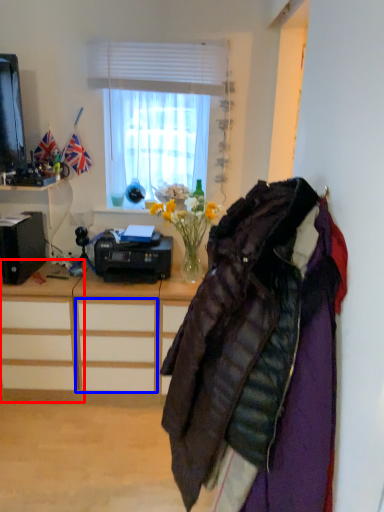
Question: Which of the following is the farthest to the observer, desk (highlighted by a red box) or drawer (highlighted by a blue box)?

Choices:
 (A) desk
 (B) drawer

Answer: (A)